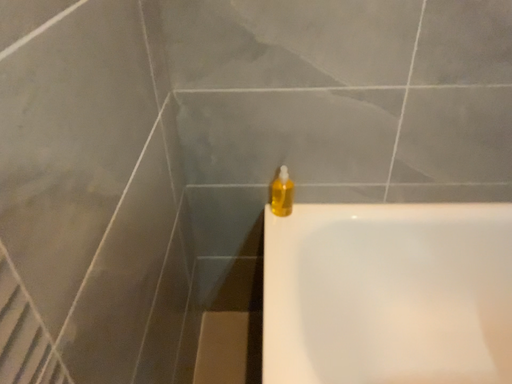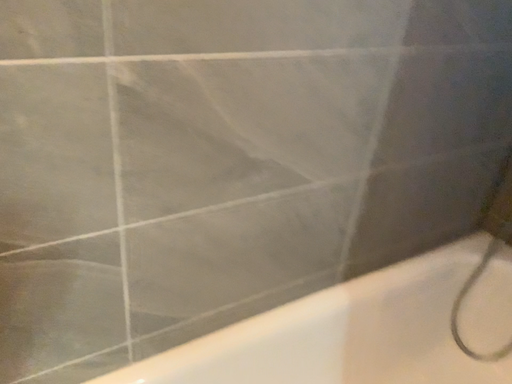
Question: Which way did the camera rotate in the video?

Choices:
 (A) rotated downward
 (B) rotated upward

Answer: (B)